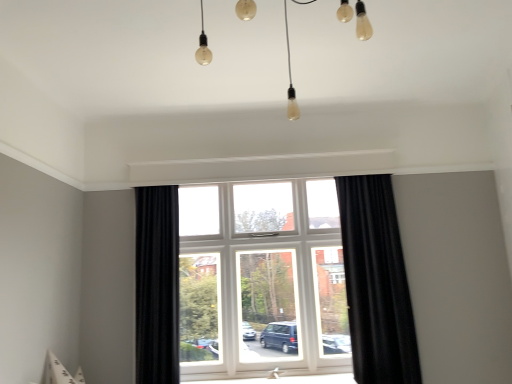
The image size is (512, 384). Identify the location of matte glass light bulbs at upper center. (290, 79).

The width and height of the screenshot is (512, 384). Describe the element at coordinates (376, 283) in the screenshot. I see `white plastic window at center` at that location.

Where is `black textured curtain at right, the second curtain positioned from the left`? black textured curtain at right, the second curtain positioned from the left is located at coordinates (376, 283).

Between black velvet curtain at center, placed as the 1th curtain when sorted from left to right, and matte glass light bulbs at upper center, which one has more height?

Standing taller between the two is black velvet curtain at center, placed as the 1th curtain when sorted from left to right.

Is matte glass light bulbs at upper center inside black velvet curtain at center, placed as the 1th curtain when sorted from left to right?

Actually, matte glass light bulbs at upper center is outside black velvet curtain at center, placed as the 1th curtain when sorted from left to right.

From a real-world perspective, which is physically above, black velvet curtain at center, placed as the second curtain when sorted from right to left, or matte glass light bulbs at upper center?

matte glass light bulbs at upper center, from a real-world perspective.

Between black velvet curtain at center, placed as the 1th curtain when sorted from left to right, and matte glass light bulbs at upper center, which one appears on the right side from the viewer's perspective?

matte glass light bulbs at upper center is more to the right.

Considering the sizes of objects black textured curtain at right, the second curtain positioned from the left, and white plastic window at center in the image provided, who is wider, black textured curtain at right, the second curtain positioned from the left, or white plastic window at center?

Wider between the two is black textured curtain at right, the second curtain positioned from the left.

Is black textured curtain at right, arranged as the 1th curtain when viewed from the right, in front of or behind white plastic window at center in the image?

black textured curtain at right, arranged as the 1th curtain when viewed from the right, is in front of white plastic window at center.

Where is `curtain above the white plastic window at center (from the image's perspective)`? curtain above the white plastic window at center (from the image's perspective) is located at coordinates (376, 283).

Could you measure the distance between black textured curtain at right, arranged as the 1th curtain when viewed from the right, and white plastic window at center?

A distance of 2.29 centimeters exists between black textured curtain at right, arranged as the 1th curtain when viewed from the right, and white plastic window at center.

Identify the location of window below the matte glass light bulbs at upper center (from a real-world perspective). pyautogui.click(x=376, y=283).

Between matte glass light bulbs at upper center and white plastic window at center, which one has smaller size?

white plastic window at center is smaller.

Considering the sizes of objects matte glass light bulbs at upper center and white plastic window at center in the image provided, who is wider, matte glass light bulbs at upper center or white plastic window at center?

With larger width is matte glass light bulbs at upper center.

From a real-world perspective, between matte glass light bulbs at upper center and white plastic window at center, who is vertically higher?

matte glass light bulbs at upper center is physically above.

Would you say black velvet curtain at center, placed as the 1th curtain when sorted from left to right, is a long distance from black textured curtain at right, arranged as the 1th curtain when viewed from the right?

Yes, black velvet curtain at center, placed as the 1th curtain when sorted from left to right, and black textured curtain at right, arranged as the 1th curtain when viewed from the right, are located far from each other.

In the scene shown: Is black velvet curtain at center, placed as the second curtain when sorted from right to left, taller or shorter than black textured curtain at right, the second curtain positioned from the left?

black velvet curtain at center, placed as the second curtain when sorted from right to left, is shorter than black textured curtain at right, the second curtain positioned from the left.

From the image's perspective, would you say black velvet curtain at center, placed as the second curtain when sorted from right to left, is shown under black textured curtain at right, the second curtain positioned from the left?

Yes, from the image's perspective, black velvet curtain at center, placed as the second curtain when sorted from right to left, is beneath black textured curtain at right, the second curtain positioned from the left.

Which is in front, point (176, 211) or point (395, 227)?

The point (395, 227) is in front.

Considering the points (138, 372) and (149, 321), which point is behind, point (138, 372) or point (149, 321)?

The point (149, 321) is farther from the camera.

Is white plastic window at center oriented towards black velvet curtain at center, placed as the 1th curtain when sorted from left to right?

No.

What's the angular difference between white plastic window at center and black velvet curtain at center, placed as the second curtain when sorted from right to left,'s facing directions?

There is a 2.27-degree angle between the facing directions of white plastic window at center and black velvet curtain at center, placed as the second curtain when sorted from right to left.

From a real-world perspective, which is physically below, white plastic window at center or matte glass light bulbs at upper center?

white plastic window at center.

Relative to matte glass light bulbs at upper center, is white plastic window at center in front or behind?

white plastic window at center is positioned farther from the viewer than matte glass light bulbs at upper center.

Is point (348, 206) positioned after point (292, 82)?

That is True.

Is white plastic window at center far away from matte glass light bulbs at upper center?

That's right, there is a large distance between white plastic window at center and matte glass light bulbs at upper center.

Which object is further away from the camera, matte glass light bulbs at upper center or black velvet curtain at center, placed as the second curtain when sorted from right to left?

black velvet curtain at center, placed as the second curtain when sorted from right to left, is behind.

From a real-world perspective, count 1st curtains downward from the matte glass light bulbs at upper center and point to it. Please provide its 2D coordinates.

[(157, 285)]

Measure the distance between matte glass light bulbs at upper center and black velvet curtain at center, placed as the 1th curtain when sorted from left to right.

matte glass light bulbs at upper center and black velvet curtain at center, placed as the 1th curtain when sorted from left to right, are 8.47 feet apart from each other.

Considering the sizes of objects matte glass light bulbs at upper center and black velvet curtain at center, placed as the second curtain when sorted from right to left, in the image provided, who is thinner, matte glass light bulbs at upper center or black velvet curtain at center, placed as the second curtain when sorted from right to left,?

black velvet curtain at center, placed as the second curtain when sorted from right to left, is thinner.

Locate an element on the screen. Image resolution: width=512 pixels, height=384 pixels. the 2nd curtain positioned below the matte glass light bulbs at upper center (from the image's perspective) is located at coordinates (157, 285).

This screenshot has width=512, height=384. I want to click on window that is on the left side of black textured curtain at right, the second curtain positioned from the left, so click(x=376, y=283).

From the image, which object appears to be farther from black velvet curtain at center, placed as the second curtain when sorted from right to left, white plastic window at center or black textured curtain at right, the second curtain positioned from the left?

black textured curtain at right, the second curtain positioned from the left, lies further to black velvet curtain at center, placed as the second curtain when sorted from right to left, than the other object.

Based on their spatial positions, is black velvet curtain at center, placed as the 1th curtain when sorted from left to right, or black textured curtain at right, the second curtain positioned from the left, closer to white plastic window at center?

The object closer to white plastic window at center is black textured curtain at right, the second curtain positioned from the left.

From the image, which object appears to be farther from white plastic window at center, matte glass light bulbs at upper center or black velvet curtain at center, placed as the second curtain when sorted from right to left?

matte glass light bulbs at upper center is positioned further to the anchor white plastic window at center.

Consider the image. Based on their spatial positions, is black velvet curtain at center, placed as the second curtain when sorted from right to left, or black textured curtain at right, arranged as the 1th curtain when viewed from the right, closer to matte glass light bulbs at upper center?

The object closer to matte glass light bulbs at upper center is black textured curtain at right, arranged as the 1th curtain when viewed from the right.

Considering their positions, is white plastic window at center positioned further to matte glass light bulbs at upper center than black textured curtain at right, the second curtain positioned from the left?

black textured curtain at right, the second curtain positioned from the left, is positioned further to the anchor matte glass light bulbs at upper center.

When comparing their distances from black velvet curtain at center, placed as the 1th curtain when sorted from left to right, does black textured curtain at right, arranged as the 1th curtain when viewed from the right, or white plastic window at center seem closer?

white plastic window at center lies closer to black velvet curtain at center, placed as the 1th curtain when sorted from left to right, than the other object.

From the image, which object appears to be nearer to black textured curtain at right, arranged as the 1th curtain when viewed from the right, black velvet curtain at center, placed as the second curtain when sorted from right to left, or matte glass light bulbs at upper center?

Among the two, black velvet curtain at center, placed as the second curtain when sorted from right to left, is located nearer to black textured curtain at right, arranged as the 1th curtain when viewed from the right.

Considering their positions, is matte glass light bulbs at upper center positioned closer to black velvet curtain at center, placed as the second curtain when sorted from right to left, than black textured curtain at right, arranged as the 1th curtain when viewed from the right?

black textured curtain at right, arranged as the 1th curtain when viewed from the right.

At what (x,y) coordinates should I click in order to perform the action: click on window between black velvet curtain at center, placed as the second curtain when sorted from right to left, and black textured curtain at right, arranged as the 1th curtain when viewed from the right, from left to right. Please return your answer as a coordinate pair (x, y). Looking at the image, I should click on (376, 283).

Find the location of a particular element. The height and width of the screenshot is (384, 512). curtain located between matte glass light bulbs at upper center and black velvet curtain at center, placed as the second curtain when sorted from right to left, in the depth direction is located at coordinates (376, 283).